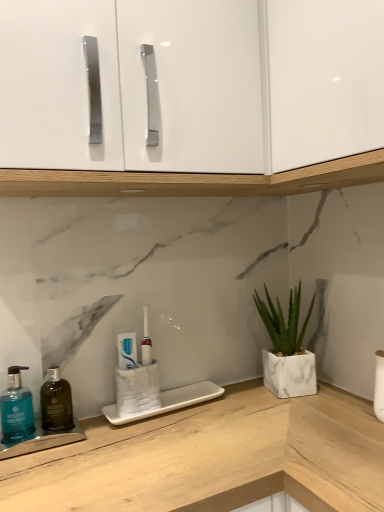
Question: Is teal matte soap dispenser at lower left looking in the opposite direction of dark green glass mouthwash at left?

Choices:
 (A) yes
 (B) no

Answer: (B)

Question: Does teal matte soap dispenser at lower left come in front of dark green glass mouthwash at left?

Choices:
 (A) yes
 (B) no

Answer: (A)

Question: Is teal matte soap dispenser at lower left touching dark green glass mouthwash at left?

Choices:
 (A) yes
 (B) no

Answer: (A)

Question: Considering the relative positions of teal matte soap dispenser at lower left and dark green glass mouthwash at left in the image provided, is teal matte soap dispenser at lower left behind dark green glass mouthwash at left?

Choices:
 (A) yes
 (B) no

Answer: (B)

Question: From the image's perspective, is teal matte soap dispenser at lower left located beneath dark green glass mouthwash at left?

Choices:
 (A) yes
 (B) no

Answer: (B)

Question: Can you confirm if teal matte soap dispenser at lower left is taller than dark green glass mouthwash at left?

Choices:
 (A) no
 (B) yes

Answer: (A)

Question: Is white marble planter at right thinner than white glossy toothpaste at center?

Choices:
 (A) no
 (B) yes

Answer: (A)

Question: Can you confirm if white marble planter at right is positioned to the left of white glossy toothpaste at center?

Choices:
 (A) no
 (B) yes

Answer: (A)

Question: From the image's perspective, would you say white marble planter at right is shown under white glossy toothpaste at center?

Choices:
 (A) yes
 (B) no

Answer: (B)

Question: Does white marble planter at right come behind white glossy toothpaste at center?

Choices:
 (A) no
 (B) yes

Answer: (B)

Question: Does white marble planter at right have a larger size compared to white glossy toothpaste at center?

Choices:
 (A) yes
 (B) no

Answer: (A)

Question: Does white marble planter at right appear on the right side of white glossy toothpaste at center?

Choices:
 (A) yes
 (B) no

Answer: (A)

Question: Is white glossy toothpaste at center wider than dark green glass mouthwash at left?

Choices:
 (A) no
 (B) yes

Answer: (A)